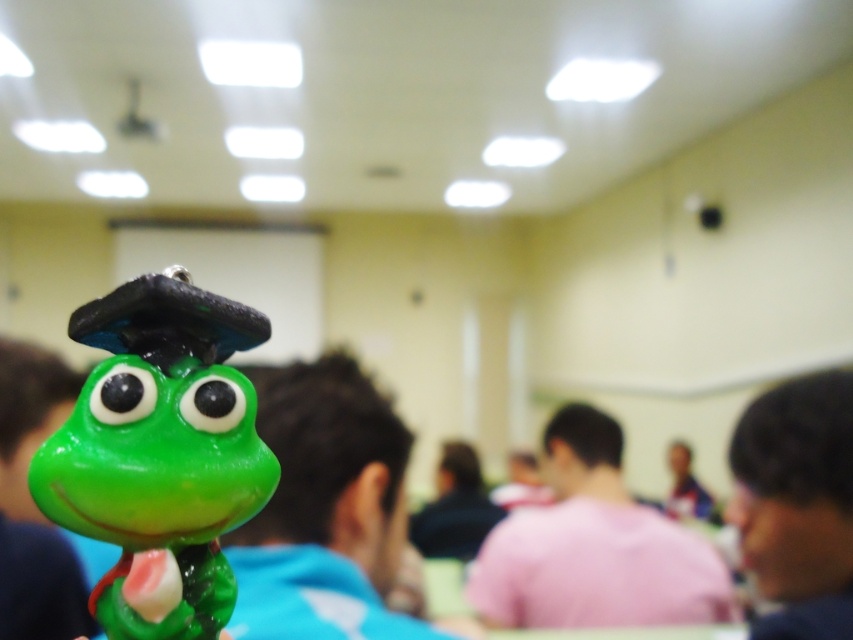
Does pink matte shirt at center appear on the right side of dark brown hair at lower right?

No, pink matte shirt at center is not to the right of dark brown hair at lower right.

Describe the element at coordinates (595, 547) in the screenshot. The image size is (853, 640). I see `pink matte shirt at center` at that location.

Describe the element at coordinates (595, 547) in the screenshot. This screenshot has width=853, height=640. I see `pink matte shirt at center` at that location.

Where is `pink matte shirt at center`? pink matte shirt at center is located at coordinates (595, 547).

Can you confirm if green matte plastic frog at center is positioned to the right of dark brown hair at lower right?

In fact, green matte plastic frog at center is to the left of dark brown hair at lower right.

Between green matte plastic frog at center and dark brown hair at lower right, which one appears on the left side from the viewer's perspective?

From the viewer's perspective, green matte plastic frog at center appears more on the left side.

This screenshot has width=853, height=640. In order to click on green matte plastic frog at center in this screenshot , I will do `click(160, 452)`.

Between green matte plastic frog at center and pink matte shirt at center, which one has less height?

green matte plastic frog at center

Between green matte plastic frog at center and pink matte shirt at center, which one appears on the left side from the viewer's perspective?

From the viewer's perspective, green matte plastic frog at center appears more on the left side.

Is point (189, 426) behind point (663, 556)?

No.

Identify the location of green matte plastic frog at center. (160, 452).